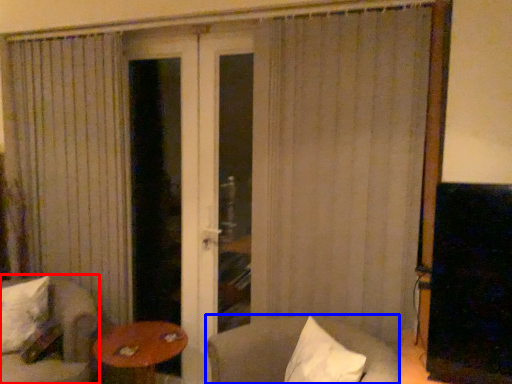
Question: Which of the following is the farthest to the observer, chair (highlighted by a red box) or chair (highlighted by a blue box)?

Choices:
 (A) chair
 (B) chair

Answer: (A)